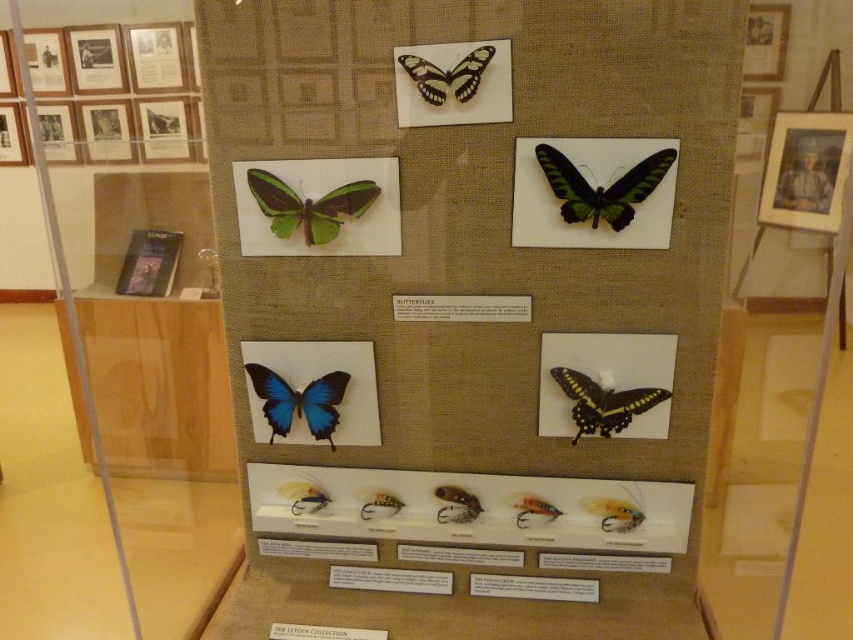
You are a visitor looking at the display case. There is a point at coordinates (447, 74). What object is located at that point?

The point at coordinates (447, 74) indicates the white matte butterfly at upper center.

You are an entomologist examining the display case. You need to locate the green matte butterfly at upper center. According to the coordinates provided, where exactly is it positioned within the display case?

The green matte butterfly at upper center is positioned at coordinates point (309, 205) within the display case.